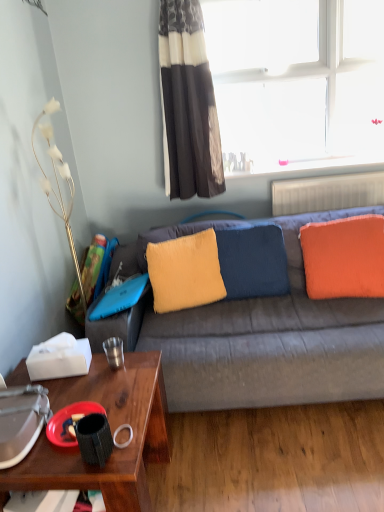
Where is `free space above wooden desk at lower left (from a real-world perspective)`? The image size is (384, 512). free space above wooden desk at lower left (from a real-world perspective) is located at coordinates (82, 398).